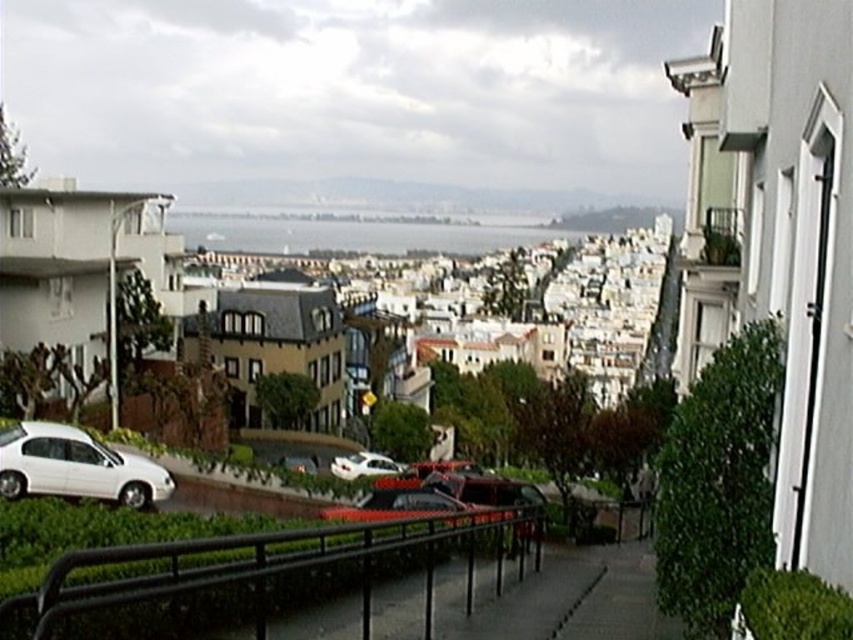
Who is lower down, black metal railing at center or white matte car at lower left?

Positioned lower is black metal railing at center.

Can you confirm if black metal railing at center is shorter than white matte car at lower left?

No.

Who is more forward, (466, 540) or (144, 474)?

Positioned in front is point (144, 474).

Find the location of a particular element. This screenshot has height=640, width=853. black metal railing at center is located at coordinates (254, 576).

Who is more forward, [270,557] or [347,454]?

Point [270,557] is more forward.

This screenshot has width=853, height=640. What are the coordinates of `black metal railing at center` in the screenshot? It's located at (254, 576).

Does white matte building at center lie in front of shiny silver car at center?

No.

Does white matte building at center have a lesser width compared to shiny silver car at center?

No.

Which is behind, point (602, 228) or point (296, 461)?

Positioned behind is point (602, 228).

Where is `white matte building at center`? This screenshot has width=853, height=640. white matte building at center is located at coordinates click(614, 218).